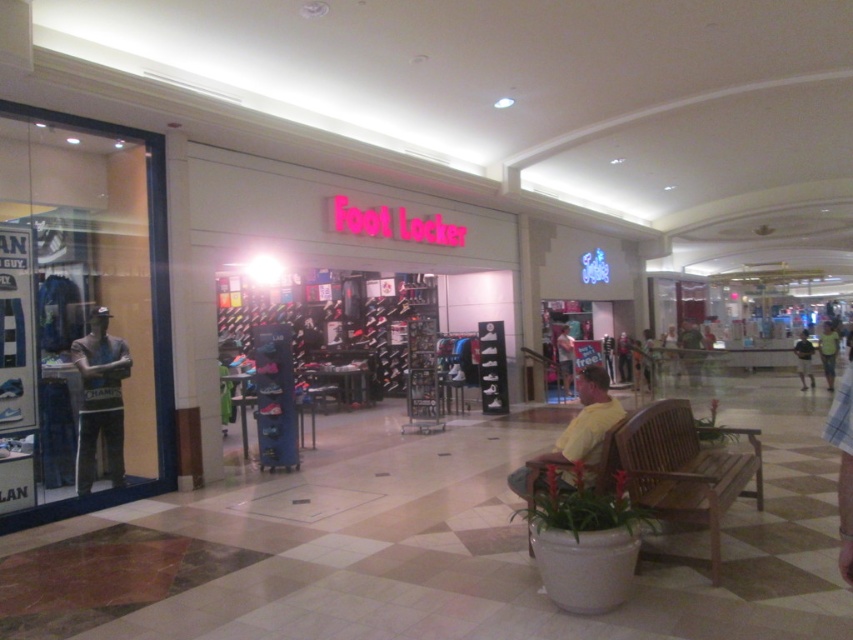
Question: In this image, where is gray fabric mannequin at left located relative to yellow cotton shirt at lower right?

Choices:
 (A) left
 (B) right

Answer: (A)

Question: Which point is farther from the camera taking this photo?

Choices:
 (A) (653, 408)
 (B) (822, 346)
 (C) (599, 422)
 (D) (801, 348)

Answer: (D)

Question: In this image, where is gray fabric mannequin at left located relative to yellow cotton shirt at lower right?

Choices:
 (A) right
 (B) left

Answer: (B)

Question: Which object appears closest to the camera in this image?

Choices:
 (A) green cotton shirt at lower right
 (B) gray fabric mannequin at left
 (C) yellow cotton shirt at lower right

Answer: (C)

Question: Among these objects, which one is nearest to the camera?

Choices:
 (A) light brown shorts at center
 (B) wooden bench at lower right

Answer: (B)

Question: Is green cotton shirt at lower right to the left of yellow cotton shirt at center from the viewer's perspective?

Choices:
 (A) no
 (B) yes

Answer: (A)